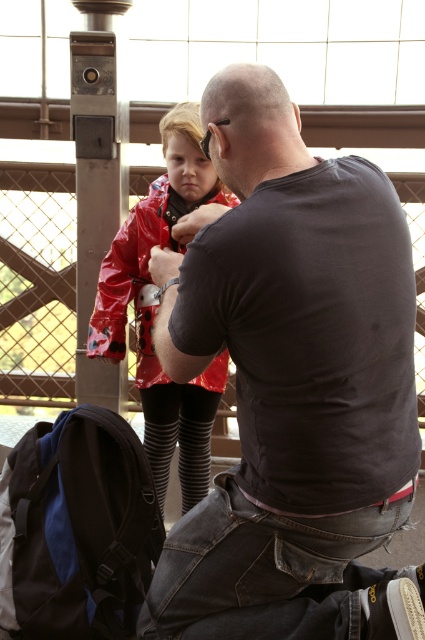
Between point (302, 355) and point (93, 346), which one is positioned in front?

Point (302, 355)

Describe the element at coordinates (288, 372) in the screenshot. I see `dark gray t-shirt at center` at that location.

This screenshot has height=640, width=425. What are the coordinates of `dark gray t-shirt at center` in the screenshot? It's located at (288, 372).